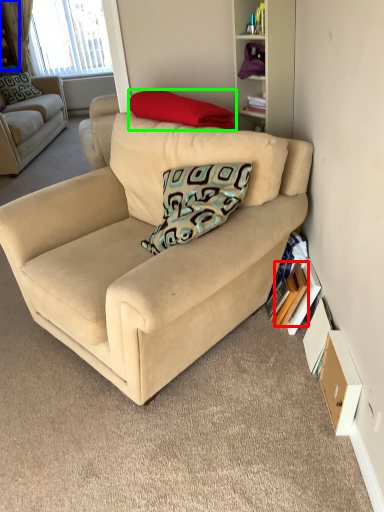
Question: Estimate the real-world distances between objects in this image. Which object is farther from paperback book (highlighted by a red box), shelf (highlighted by a blue box) or pillow (highlighted by a green box)?

Choices:
 (A) shelf
 (B) pillow

Answer: (A)